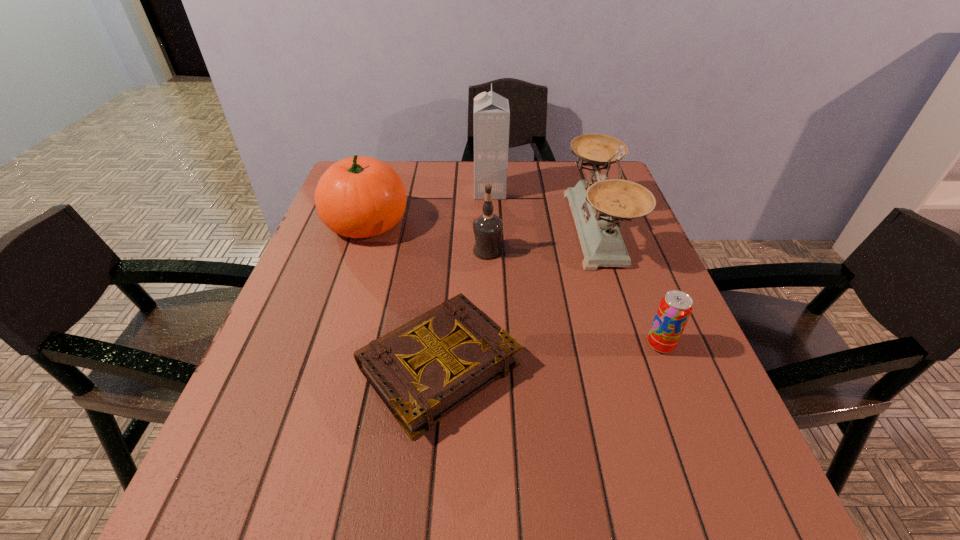
The width and height of the screenshot is (960, 540). What are the coordinates of `vacant area in the image that satisfies the following two spatial constraints: 1. on the front label of the soda can; 2. on the left side of the vodka` in the screenshot? It's located at (490, 345).

The width and height of the screenshot is (960, 540). What are the coordinates of `free point that satisfies the following two spatial constraints: 1. on the front-facing side of the second shortest object; 2. on the right side of the scale` in the screenshot? It's located at (635, 345).

Image resolution: width=960 pixels, height=540 pixels. Identify the location of free space that satisfies the following two spatial constraints: 1. on the front-facing side of the scale; 2. on the back side of the second shortest object. (635, 345).